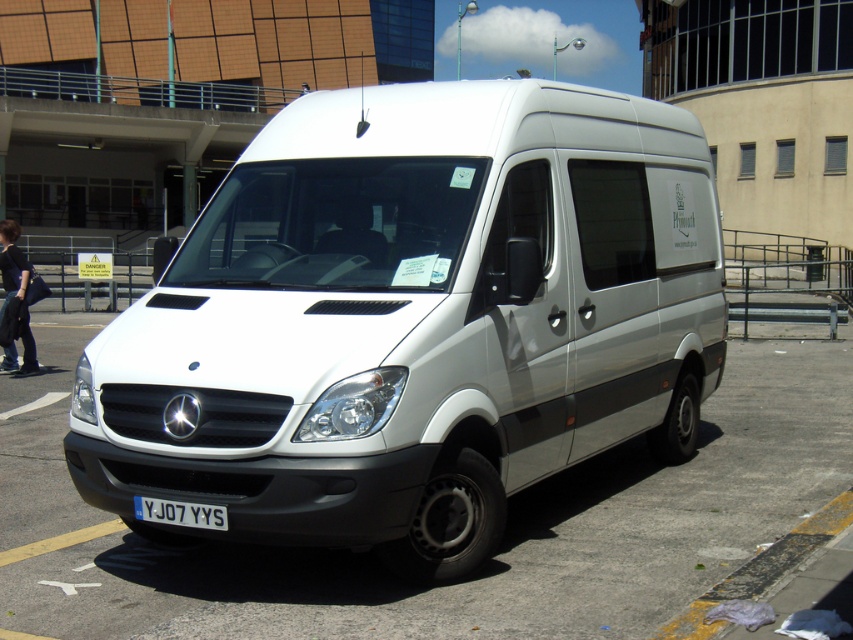
Is yellow asphalt curb at lower right shorter than white plastic license plate at center?

Incorrect, yellow asphalt curb at lower right's height does not fall short of white plastic license plate at center's.

Describe the element at coordinates (761, 570) in the screenshot. I see `yellow asphalt curb at lower right` at that location.

Which is behind, point (801, 538) or point (200, 522)?

Point (801, 538)

At what (x,y) coordinates should I click in order to perform the action: click on yellow asphalt curb at lower right. Please return your answer as a coordinate pair (x, y). Image resolution: width=853 pixels, height=640 pixels. Looking at the image, I should click on (761, 570).

Can you confirm if white matte van at center is wider than yellow asphalt curb at lower right?

Correct, the width of white matte van at center exceeds that of yellow asphalt curb at lower right.

Which of these two, white matte van at center or yellow asphalt curb at lower right, stands shorter?

yellow asphalt curb at lower right is shorter.

What are the coordinates of `white matte van at center` in the screenshot? It's located at (486, 561).

Identify the location of white matte van at center. click(486, 561).

Consider the image. Is white metallic van at center to the left of white plastic license plate at center from the viewer's perspective?

No, white metallic van at center is not to the left of white plastic license plate at center.

Is white metallic van at center thinner than white plastic license plate at center?

Incorrect, white metallic van at center's width is not less than white plastic license plate at center's.

Describe the element at coordinates (415, 320) in the screenshot. The image size is (853, 640). I see `white metallic van at center` at that location.

In order to click on white metallic van at center in this screenshot , I will do [415, 320].